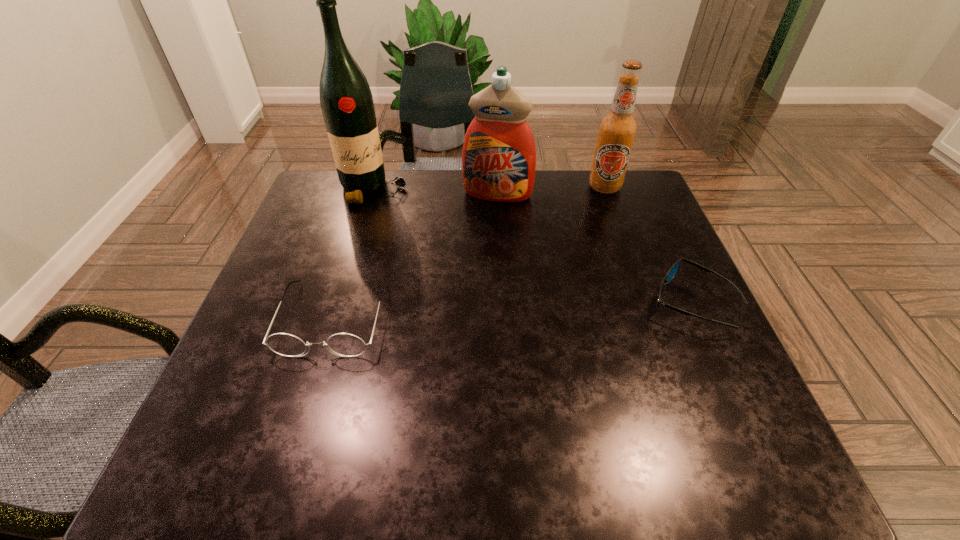
Where is `beer bottle present at the far edge`? This screenshot has width=960, height=540. beer bottle present at the far edge is located at coordinates click(617, 130).

Identify the location of spectacles that is positioned at the left edge. Image resolution: width=960 pixels, height=540 pixels. (344, 344).

This screenshot has height=540, width=960. What are the coordinates of `wine bottle situated at the left edge` in the screenshot? It's located at click(346, 101).

Locate an element on the screen. Image resolution: width=960 pixels, height=540 pixels. sunglasses that is at the right edge is located at coordinates (672, 272).

Find the location of a particular element. The width and height of the screenshot is (960, 540). beer bottle present at the right edge is located at coordinates (617, 130).

Where is `object that is at the far left corner`? This screenshot has width=960, height=540. object that is at the far left corner is located at coordinates (346, 101).

Where is `object that is at the far right corner`? object that is at the far right corner is located at coordinates (617, 130).

At what (x,y) coordinates should I click in order to perform the action: click on vacant area at the far edge. Please return your answer as a coordinate pair (x, y). This screenshot has height=540, width=960. Looking at the image, I should click on (566, 200).

Where is `vacant space at the near edge of the desktop`? The width and height of the screenshot is (960, 540). vacant space at the near edge of the desktop is located at coordinates (507, 403).

Find the location of a particular element. Image resolution: width=960 pixels, height=540 pixels. vacant space at the left edge of the desktop is located at coordinates (327, 258).